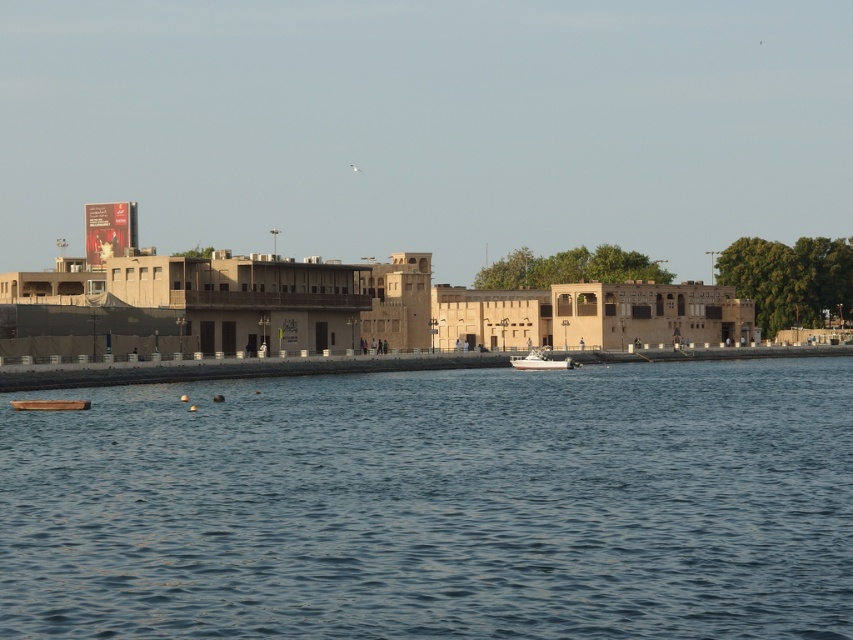
Question: Is blue water at lower center below white glossy boat at center?

Choices:
 (A) no
 (B) yes

Answer: (B)

Question: Does blue water at lower center appear on the right side of white glossy boat at center?

Choices:
 (A) no
 (B) yes

Answer: (A)

Question: Can you confirm if blue water at lower center is positioned below white glossy boat at center?

Choices:
 (A) no
 (B) yes

Answer: (B)

Question: Which of the following is the farthest from the observer?

Choices:
 (A) blue water at lower center
 (B) white glossy boat at center

Answer: (B)